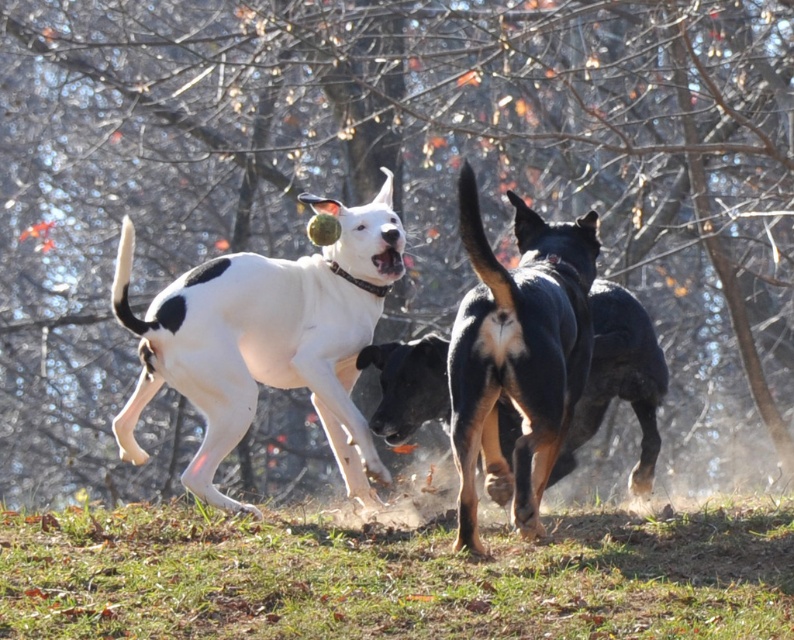
You are a dog owner observing the scene. You notice the white matte dog at center and the black glossy dog at center. Which dog is taller?

The white matte dog at center is taller than the black glossy dog at center.

Looking at this image, you are a photographer trying to capture the white matte dog at center in the image. The camera has a fixed focus point at position (266, 340). Will this focus point land on the white matte dog at center?

Yes, the focus point at (266, 340) corresponds to the white matte dog at center, so it will land on the white matte dog at center.

You are standing in the grassy area and want to place a small picnic blanket. The green grass at lower center and the black glossy dog at center are in your view. Which area would be more suitable for placing the blanket based on their sizes?

The green grass at lower center is larger in size than the black glossy dog at center, so placing the picnic blanket on the green grass at lower center would be more suitable due to its larger area.